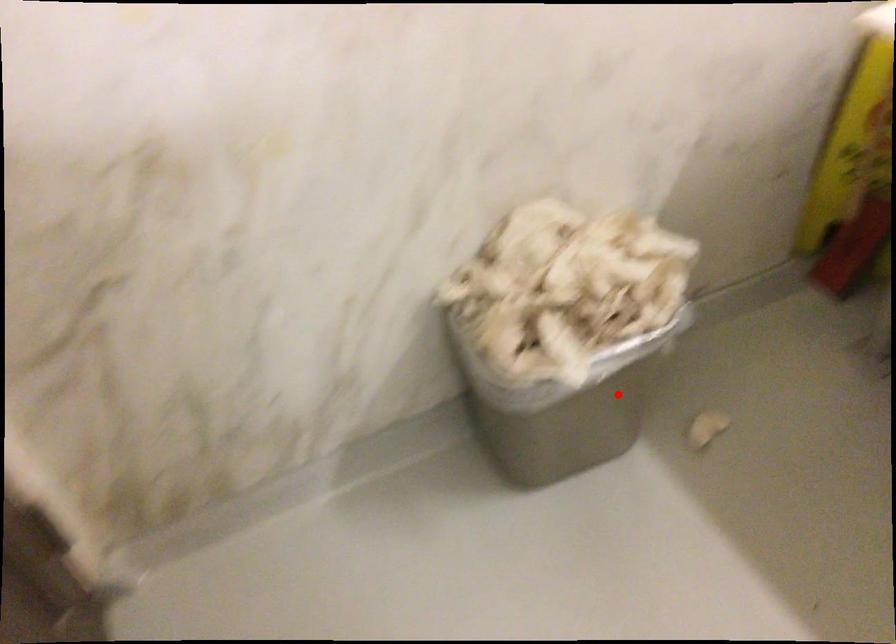
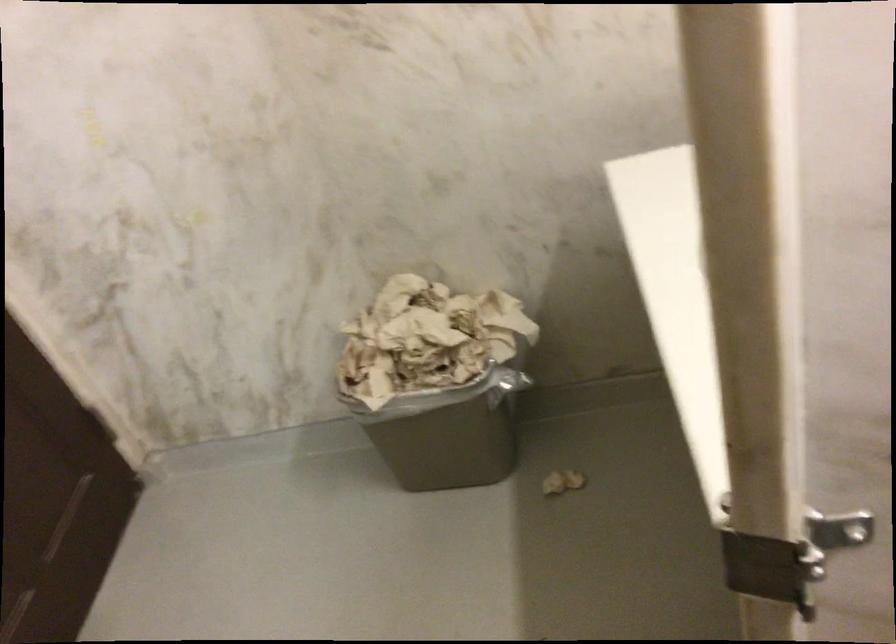
Where in the second image is the point corresponding to the highlighted location from the first image?

(449, 431)